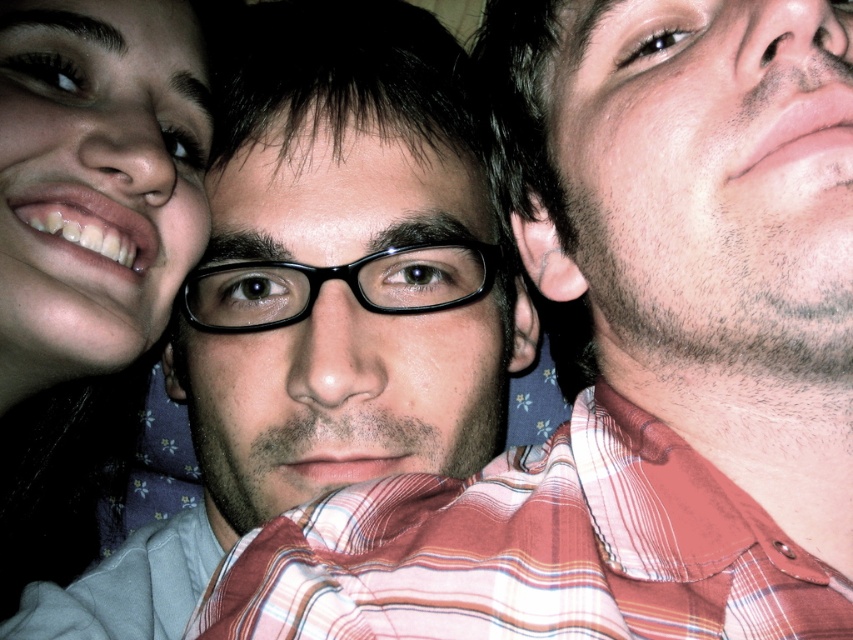
Question: Which object is closer to the camera taking this photo?

Choices:
 (A) black matte glasses at center
 (B) matte black glasses at left

Answer: (B)

Question: Considering the real-world distances, which object is closest to the matte black glasses at left?

Choices:
 (A) smooth skin face at right
 (B) black matte glasses at center

Answer: (B)

Question: Can you confirm if black matte glasses at center is positioned below matte black glasses at left?

Choices:
 (A) yes
 (B) no

Answer: (A)

Question: Does black matte glasses at center appear on the right side of matte black glasses at left?

Choices:
 (A) yes
 (B) no

Answer: (A)

Question: Which is farther from the black matte glasses at center?

Choices:
 (A) matte black glasses at left
 (B) smooth skin face at right

Answer: (B)

Question: Can you confirm if smooth skin face at right is positioned to the left of matte black glasses at left?

Choices:
 (A) no
 (B) yes

Answer: (A)